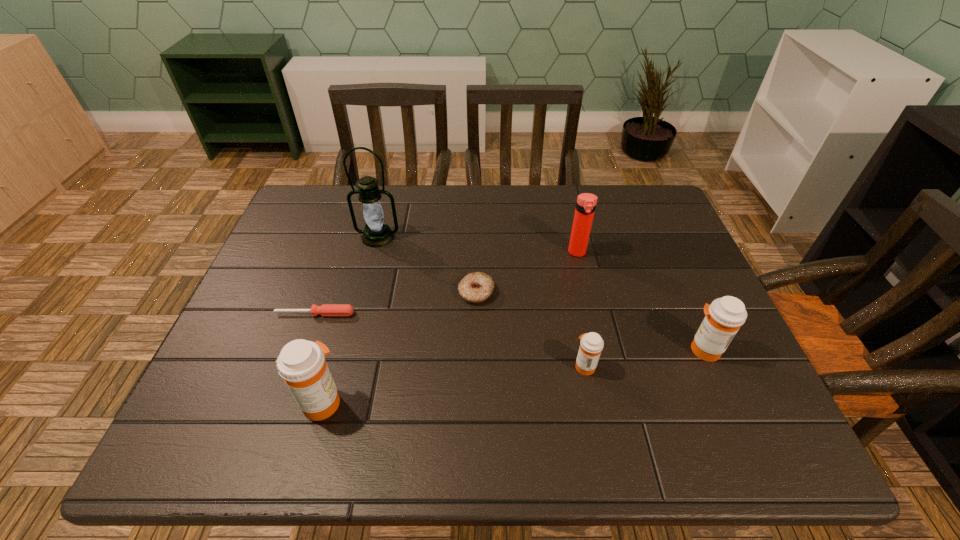
The height and width of the screenshot is (540, 960). In order to click on screwdriver in this screenshot , I will do `click(326, 309)`.

Where is `the shortest object`? the shortest object is located at coordinates (326, 309).

Locate an element on the screen. vacant space located on the right of the leftmost medicine is located at coordinates (540, 402).

Identify the location of vacant space situated on the back of the third shortest object. This screenshot has width=960, height=540. (578, 330).

I want to click on free space located 0.170m on the left of the rightmost object, so click(609, 350).

At what (x,y) coordinates should I click in order to perform the action: click on vacant space located 0.120m on the side where the lantern emits light. Please return your answer as a coordinate pair (x, y). Looking at the image, I should click on (368, 279).

Find the location of `vacant region located on the left of the thermos bottle`. vacant region located on the left of the thermos bottle is located at coordinates (461, 253).

Find the location of `vacant space situated 0.260m on the front of the doughnut`. vacant space situated 0.260m on the front of the doughnut is located at coordinates (475, 405).

Find the location of a particular element. Image resolution: width=960 pixels, height=540 pixels. vacant space located 0.140m on the front of the fourth nearest object is located at coordinates (296, 369).

Where is `object located at the far edge`? This screenshot has height=540, width=960. object located at the far edge is located at coordinates (377, 233).